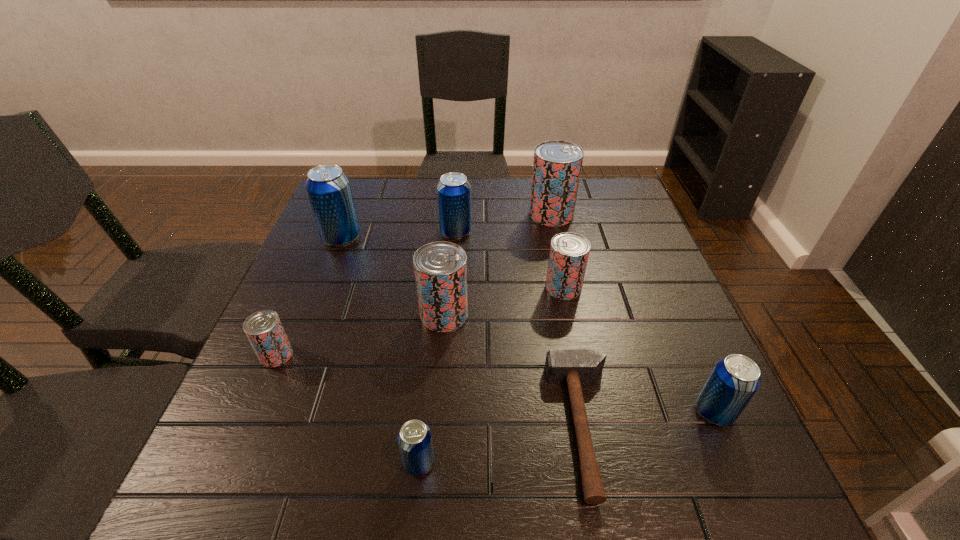
Find the location of a particular element. Image resolution: width=960 pixels, height=540 pixels. the farthest red beer can is located at coordinates (x=557, y=164).

Locate an element on the screen. The image size is (960, 540). the leftmost blue beer can is located at coordinates (328, 188).

The image size is (960, 540). Identify the location of the second biggest blue beer can. (453, 191).

The width and height of the screenshot is (960, 540). Find the location of `the third smallest red beer can`. the third smallest red beer can is located at coordinates (440, 268).

The height and width of the screenshot is (540, 960). I want to click on the third biggest red beer can, so click(569, 252).

Find the location of `the rightmost beer can`. the rightmost beer can is located at coordinates (733, 382).

Locate an element on the screen. the rightmost object is located at coordinates (733, 382).

Find the location of a particular element. This screenshot has width=960, height=540. the nearest red beer can is located at coordinates (264, 329).

Identify the location of the sixth farthest beer can. The width and height of the screenshot is (960, 540). (264, 329).

You are a GUI agent. You are given a task and a screenshot of the screen. Output one action in this format:
    pyautogui.click(x=<x>, y=<y>)
    Task: Click on the nearest blue beer can
    Image resolution: width=960 pixels, height=540 pixels.
    Given the screenshot: What is the action you would take?
    pyautogui.click(x=414, y=439)